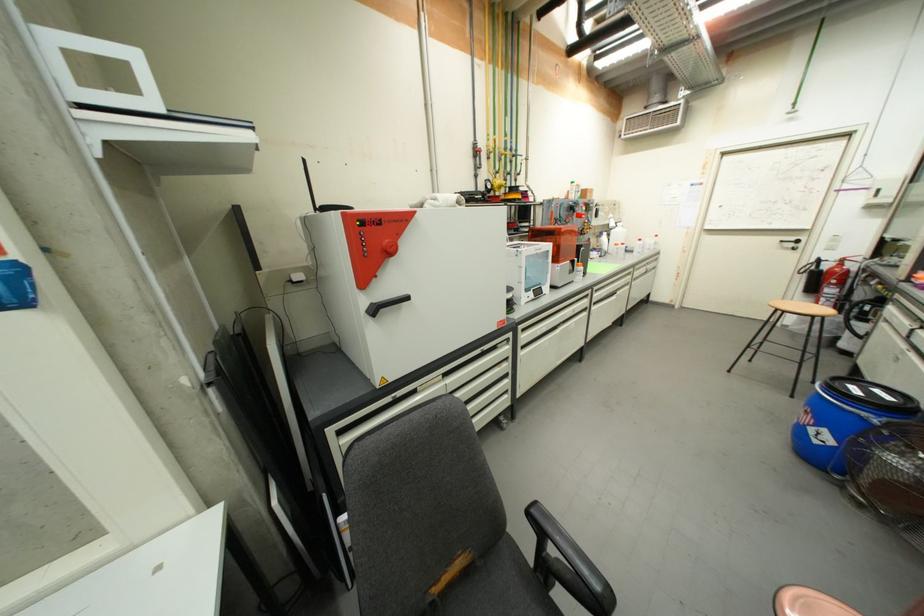
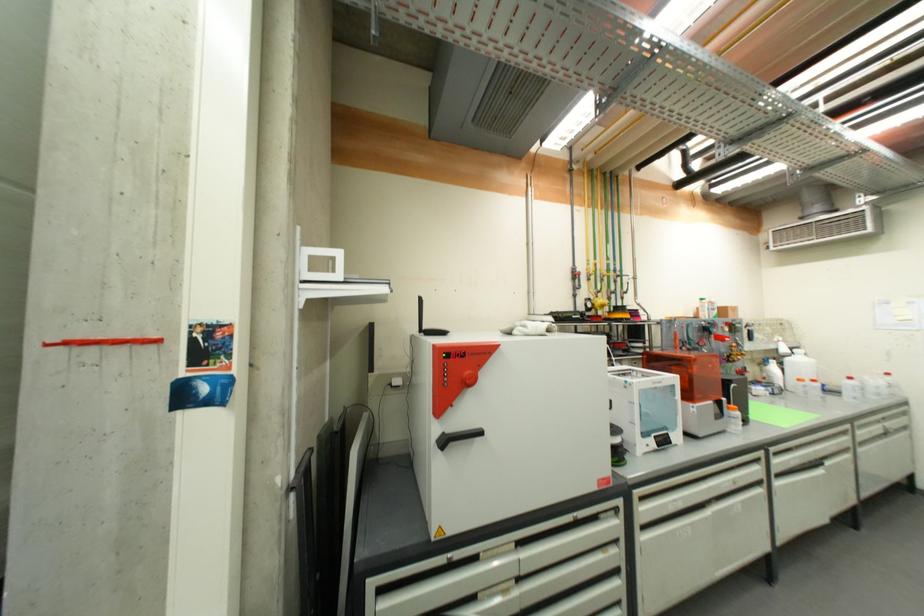
Locate, in the second image, the point that corresponds to pixel 645 241 in the first image.

(856, 379)